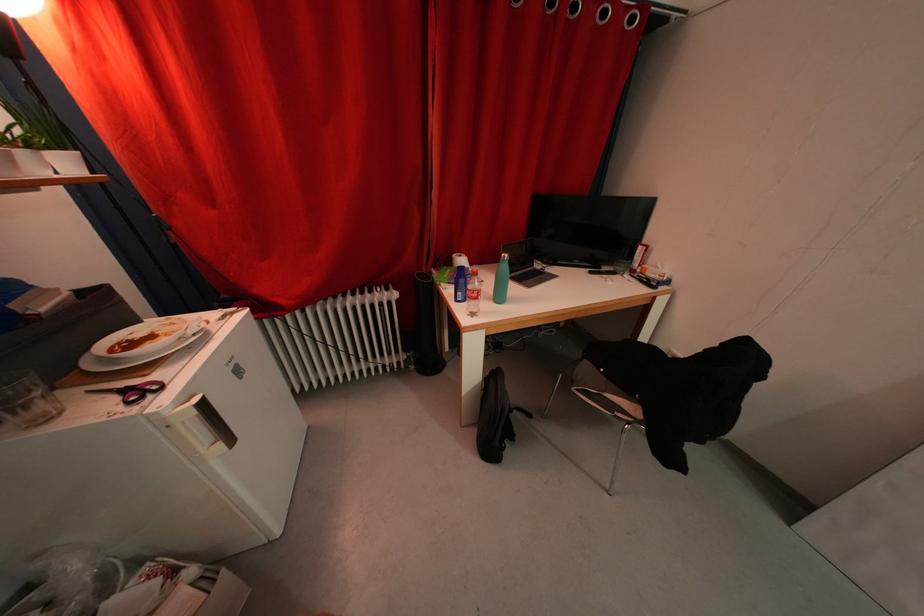
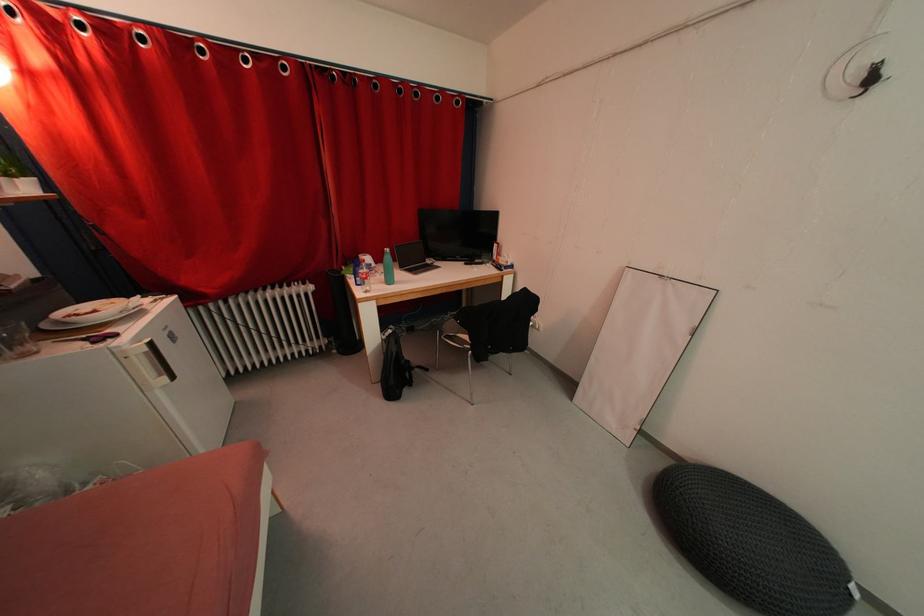
What movement of the cameraman would produce the second image?

The cameraman moved toward right, backward.